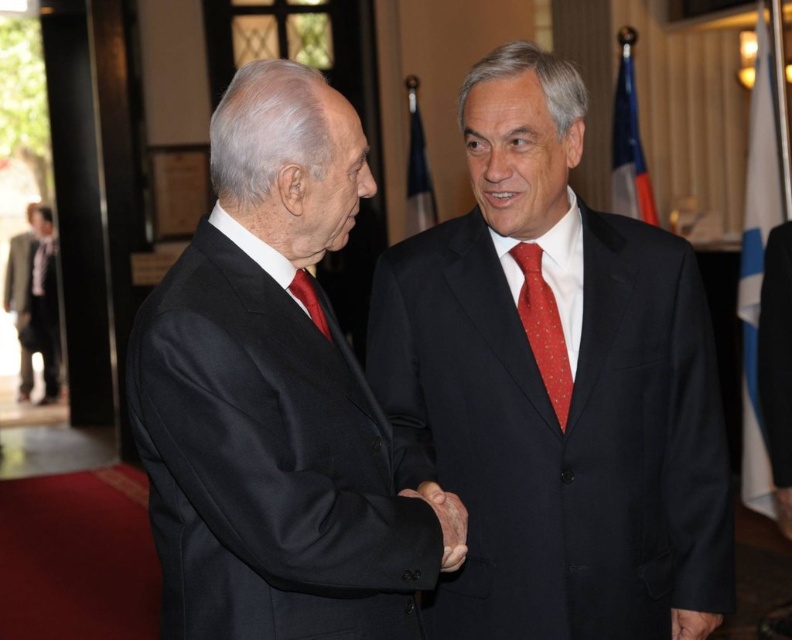
You are a photographer standing at the center of the room where the two men are shaking hands. You want to take a photo that includes both the point at coordinates point (550, 337) and point (311, 320). However, you notice that one of the points is partially obscured by a flag in the background. Which point is more likely to be visible in your photo?

Point (311, 320) is more likely to be visible because it is in front of point (550, 337), which is behind and possibly obscured by the flag.

In the scene, there are two men shaking hands. One is wearing a matte black suit at center and the other has a red dotted silk tie at right. Based on their positions, which man is standing to the left of the other?

The matte black suit at center is to the right of the red dotted silk tie at right, so the man with the red dotted silk tie at right is standing to the left of the man in the matte black suit at center.